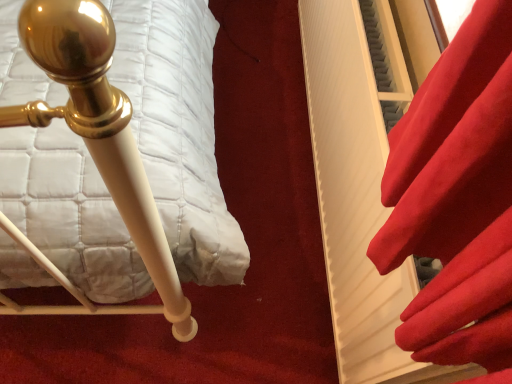
Question: Considering the positions of satin red curtain at right and matte white bedpost at left in the image, is satin red curtain at right taller or shorter than matte white bedpost at left?

Choices:
 (A) short
 (B) tall

Answer: (B)

Question: From a real-world perspective, is satin red curtain at right physically located above or below matte white bedpost at left?

Choices:
 (A) below
 (B) above

Answer: (B)

Question: Considering their positions, is satin red curtain at right located in front of or behind matte white bedpost at left?

Choices:
 (A) front
 (B) behind

Answer: (A)

Question: From a real-world perspective, relative to satin red curtain at right, is matte white bedpost at left vertically above or below?

Choices:
 (A) above
 (B) below

Answer: (B)

Question: Looking at their shapes, would you say matte white bedpost at left is wider or thinner than satin red curtain at right?

Choices:
 (A) thin
 (B) wide

Answer: (B)

Question: In the image, is matte white bedpost at left positioned in front of or behind satin red curtain at right?

Choices:
 (A) behind
 (B) front

Answer: (A)

Question: From their relative heights in the image, would you say matte white bedpost at left is taller or shorter than satin red curtain at right?

Choices:
 (A) tall
 (B) short

Answer: (B)